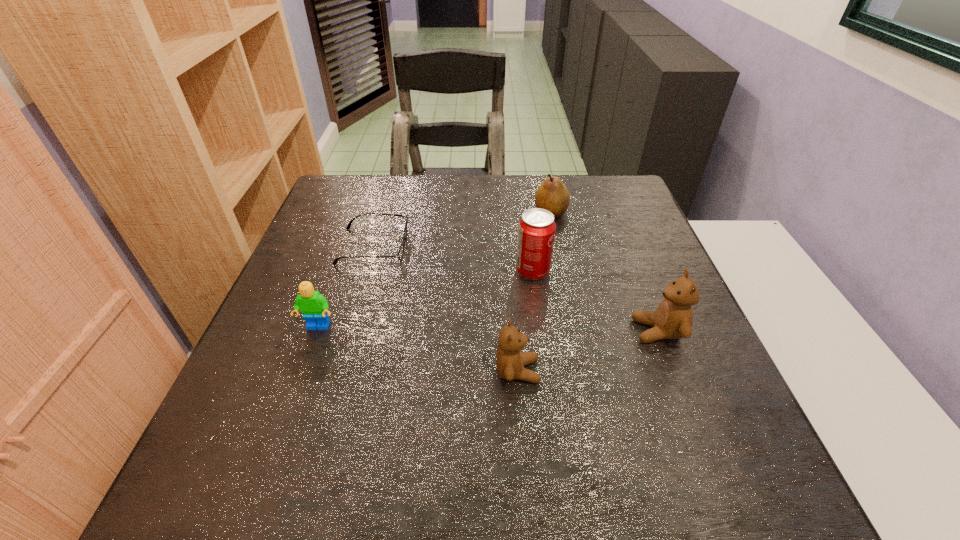
Identify the location of vacant space situated on the front-facing side of the taller teddy bear. (600, 331).

At what (x,y) coordinates should I click in order to perform the action: click on vacant position located on the front-facing side of the spectacles. Please return your answer as a coordinate pair (x, y). This screenshot has width=960, height=540. Looking at the image, I should click on (507, 246).

You are a GUI agent. You are given a task and a screenshot of the screen. Output one action in this format:
    pyautogui.click(x=<x>, y=<y>)
    Task: Click on the free spot located on the right of the pear
    
    Given the screenshot: What is the action you would take?
    pyautogui.click(x=643, y=213)

At what (x,y) coordinates should I click in order to perform the action: click on vacant region located 0.280m on the front of the soda. Please return your answer as a coordinate pair (x, y). This screenshot has width=960, height=540. Looking at the image, I should click on (548, 388).

The height and width of the screenshot is (540, 960). In order to click on vacant region located on the face of the Lego in this screenshot , I will do `click(291, 402)`.

Find the location of a particular element. The height and width of the screenshot is (540, 960). object present at the far edge is located at coordinates (552, 195).

Locate an element on the screen. This screenshot has width=960, height=540. object at the near edge is located at coordinates (510, 360).

Locate an element on the screen. spectacles that is positioned at the left edge is located at coordinates (401, 250).

The image size is (960, 540). I want to click on Lego located in the left edge section of the desktop, so click(314, 306).

Identify the location of object located in the right edge section of the desktop. This screenshot has width=960, height=540. (673, 318).